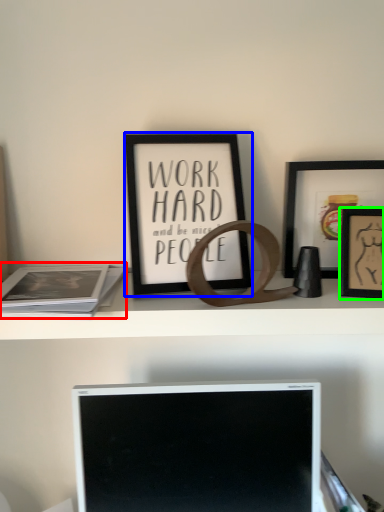
Question: Which is farther away from paperback book (highlighted by a red box)? picture frame (highlighted by a blue box) or picture frame (highlighted by a green box)?

Choices:
 (A) picture frame
 (B) picture frame

Answer: (B)